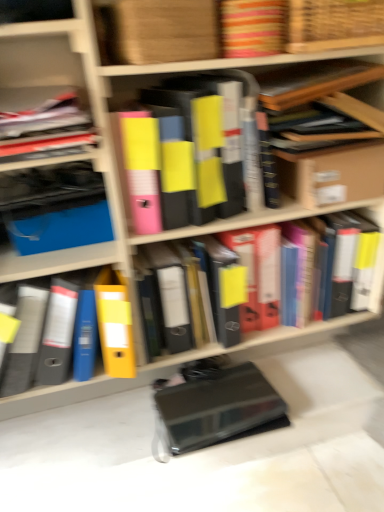
You are a GUI agent. You are given a task and a screenshot of the screen. Output one action in this format:
    pyautogui.click(x=<x>, y=<y>)
    Task: Click on the free point to the left of black matte book at lower center
    The width and height of the screenshot is (384, 512).
    Given the screenshot: What is the action you would take?
    pyautogui.click(x=113, y=432)